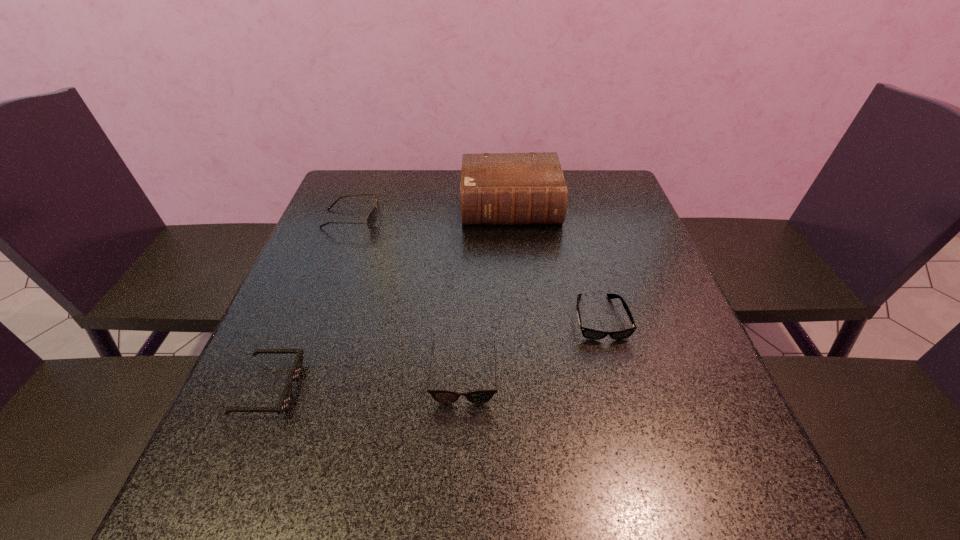
Image resolution: width=960 pixels, height=540 pixels. In order to click on Bible at the far edge in this screenshot , I will do `click(496, 188)`.

At what (x,y) coordinates should I click in order to perform the action: click on sunglasses present at the far edge. Please return your answer as a coordinate pair (x, y). Looking at the image, I should click on (x=372, y=217).

This screenshot has width=960, height=540. I want to click on object that is at the right edge, so click(x=588, y=333).

Image resolution: width=960 pixels, height=540 pixels. Identify the location of object present at the far left corner. (372, 217).

The image size is (960, 540). What are the coordinates of `free spot at the far edge of the desktop` in the screenshot? It's located at (386, 203).

What are the coordinates of `vacant area at the left edge` in the screenshot? It's located at (300, 339).

Image resolution: width=960 pixels, height=540 pixels. Find the location of `vacant region at the right edge of the desktop`. vacant region at the right edge of the desktop is located at coordinates (636, 235).

Locate an element on the screen. This screenshot has width=960, height=540. blank area at the far left corner is located at coordinates (349, 170).

Locate an element on the screen. This screenshot has width=960, height=540. vacant space at the far right corner is located at coordinates (576, 179).

This screenshot has width=960, height=540. In order to click on free space between the third sunglasses from left to right and the Bible in this screenshot , I will do click(x=487, y=291).